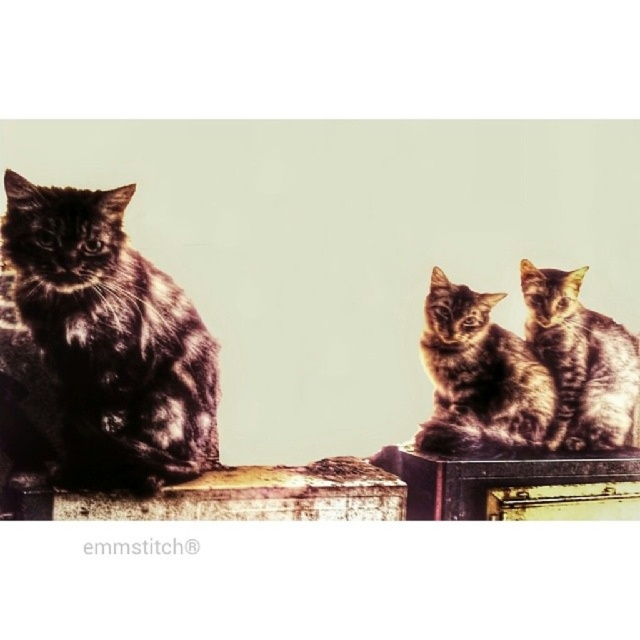
You are a cat owner who wants to place a toy between the shiny brown fur at center and the tabby fur cat at right. Based on their positions, where should you place the toy to ensure it is between them?

The shiny brown fur at center is below the tabby fur cat at right, so placing the toy between them would require positioning it above the shiny brown fur at center and below the tabby fur cat at right.

You are standing in front of the wooden surface where the cats are sitting. There is a shiny black cat at left and two smaller cats to the right. If you want to place a treat exactly at the point marked by coordinates point [112,339], which cat would the treat be closest to?

The treat placed at point [112,339] would be closest to the shiny black cat at left, as the coordinates mark its location according to the description.